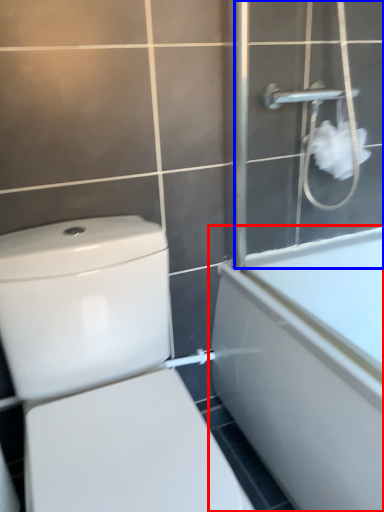
Question: Among these objects, which one is farthest to the camera, bathtub (highlighted by a red box) or screen door (highlighted by a blue box)?

Choices:
 (A) bathtub
 (B) screen door

Answer: (B)